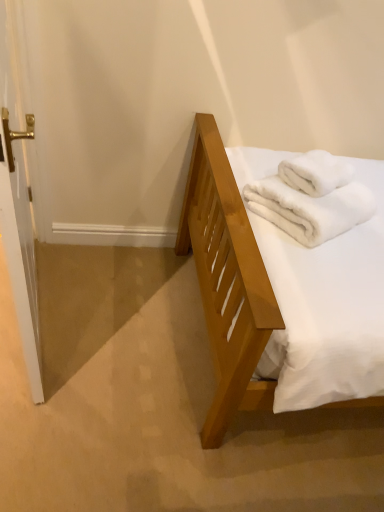
The width and height of the screenshot is (384, 512). I want to click on free space above white fluffy bath towel at upper right, positioned as the 1th bath towel in top-to-bottom order (from a real-world perspective), so 322,163.